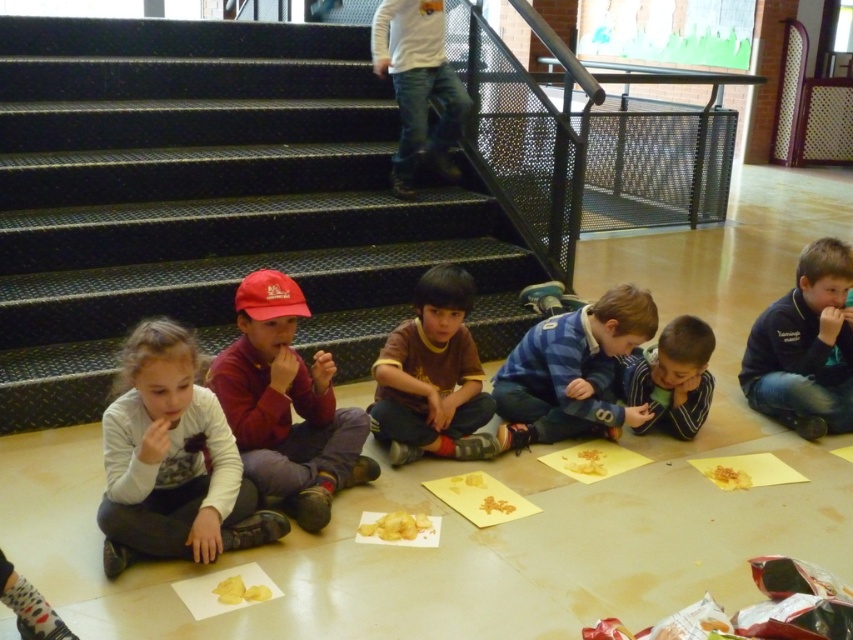
Is point (537, 342) positioned behind point (413, 524)?

Yes, it is behind point (413, 524).

Who is positioned more to the right, blue striped sweater at center or yellow matte gingerbread man at lower center?

From the viewer's perspective, blue striped sweater at center appears more on the right side.

You are a GUI agent. You are given a task and a screenshot of the screen. Output one action in this format:
    pyautogui.click(x=<x>, y=<y>)
    Task: Click on the blue striped sweater at center
    Image resolution: width=853 pixels, height=640 pixels.
    Given the screenshot: What is the action you would take?
    pyautogui.click(x=572, y=371)

Which is behind, point (372, 467) or point (380, 513)?

Positioned behind is point (372, 467).

Measure the distance between point (322,445) and camera.

Point (322,445) is 2.94 meters from camera.

What do you see at coordinates (286, 404) in the screenshot? The image size is (853, 640). I see `matte red cap at center` at bounding box center [286, 404].

Identify the location of matte red cap at center. The width and height of the screenshot is (853, 640). (286, 404).

The width and height of the screenshot is (853, 640). Describe the element at coordinates (572, 371) in the screenshot. I see `blue striped sweater at center` at that location.

Which is more to the left, blue striped sweater at center or yellow matte cookie at center?

From the viewer's perspective, yellow matte cookie at center appears more on the left side.

The width and height of the screenshot is (853, 640). Describe the element at coordinates (572, 371) in the screenshot. I see `blue striped sweater at center` at that location.

Where is `blue striped sweater at center`? The width and height of the screenshot is (853, 640). blue striped sweater at center is located at coordinates (572, 371).